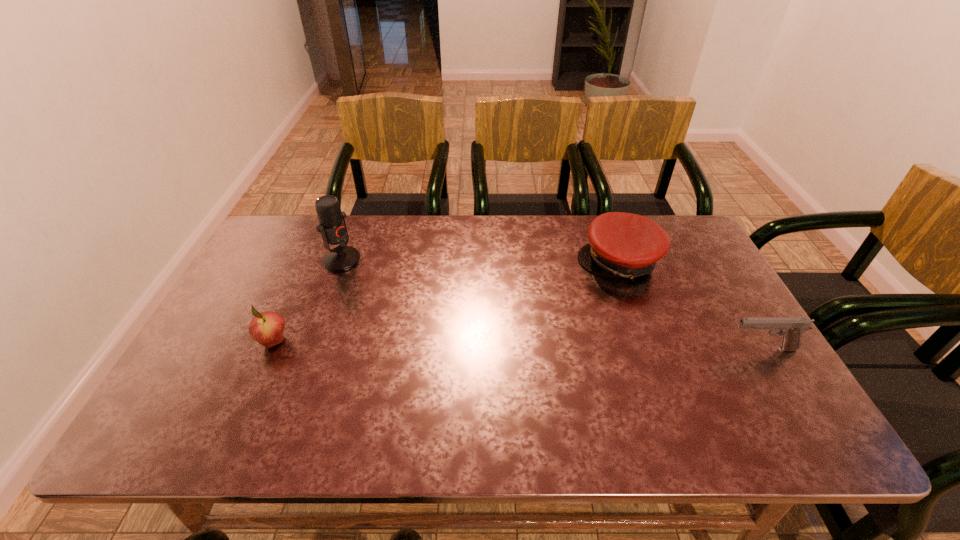
The width and height of the screenshot is (960, 540). Identify the location of object at the far right corner. (627, 245).

In the image, there is a desktop. Where is `vacant region at the far edge`? The width and height of the screenshot is (960, 540). vacant region at the far edge is located at coordinates (402, 254).

Where is `vacant space at the near edge of the desktop`? vacant space at the near edge of the desktop is located at coordinates (436, 390).

Where is `vacant space at the left edge of the desktop`? The height and width of the screenshot is (540, 960). vacant space at the left edge of the desktop is located at coordinates 239,312.

In the image, there is a desktop. Where is `vacant space at the right edge`? This screenshot has width=960, height=540. vacant space at the right edge is located at coordinates (669, 287).

The image size is (960, 540). In order to click on vacant space at the far left corner of the desktop in this screenshot , I will do `click(286, 222)`.

Locate an element on the screen. This screenshot has height=540, width=960. free space between the leftmost object and the third object from left to right is located at coordinates (446, 301).

At what (x,y) coordinates should I click in order to perform the action: click on vacant area between the third object from left to right and the tallest object. Please return your answer as a coordinate pair (x, y). This screenshot has width=960, height=540. Looking at the image, I should click on (481, 261).

Find the location of a particular element. vacant space that's between the apple and the third object from left to right is located at coordinates (446, 301).

Find the location of a particular element. This screenshot has height=540, width=960. free space between the leftmost object and the microphone is located at coordinates (308, 301).